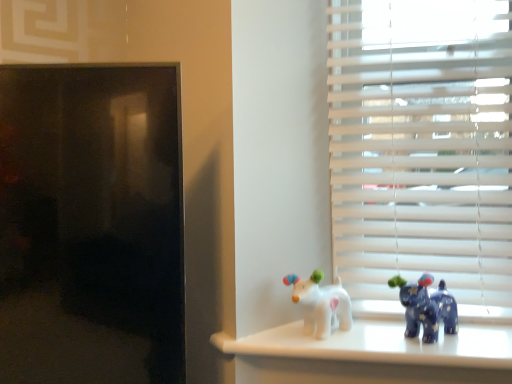
Locate an element on the screen. This screenshot has height=384, width=512. white matte blinds at right is located at coordinates (422, 151).

The image size is (512, 384). Identify the location of white glossy dog at center, positioned as the 1th toy in left-to-right order. (321, 304).

Is blue glossy elephant at right, acting as the second toy starting from the left, spatially inside white glossy dog at center, the second toy in the right-to-left sequence, or outside of it?

blue glossy elephant at right, acting as the second toy starting from the left, exists outside the volume of white glossy dog at center, the second toy in the right-to-left sequence.

Is point (433, 278) less distant than point (336, 299)?

Yes.

Which is more to the left, blue glossy elephant at right, arranged as the first toy when viewed from the right, or white glossy dog at center, positioned as the 1th toy in left-to-right order?

white glossy dog at center, positioned as the 1th toy in left-to-right order.

Does blue glossy elephant at right, acting as the second toy starting from the left, turn towards white glossy dog at center, the second toy in the right-to-left sequence?

No, blue glossy elephant at right, acting as the second toy starting from the left, is not turned towards white glossy dog at center, the second toy in the right-to-left sequence.

I want to click on window blind that is on the right side of blue glossy elephant at right, arranged as the first toy when viewed from the right, so click(422, 151).

Is blue glossy elephant at right, arranged as the first toy when viewed from the right, looking in the opposite direction of white matte blinds at right?

Yes, white matte blinds at right is at the back of blue glossy elephant at right, arranged as the first toy when viewed from the right.

Considering the positions of objects blue glossy elephant at right, arranged as the first toy when viewed from the right, and white matte blinds at right in the image provided, who is more to the left, blue glossy elephant at right, arranged as the first toy when viewed from the right, or white matte blinds at right?

From the viewer's perspective, blue glossy elephant at right, arranged as the first toy when viewed from the right, appears more on the left side.

Would you say blue glossy elephant at right, acting as the second toy starting from the left, is outside white matte blinds at right?

Yes.

At what (x,y) coordinates should I click in order to perform the action: click on toy that is the 1st one when counting forward from the white matte blinds at right. Please return your answer as a coordinate pair (x, y). The width and height of the screenshot is (512, 384). Looking at the image, I should click on (321, 304).

Looking at this image, is white matte blinds at right smaller than white glossy dog at center, positioned as the 1th toy in left-to-right order?

No, white matte blinds at right is not smaller than white glossy dog at center, positioned as the 1th toy in left-to-right order.

Would you say white matte blinds at right is to the left or to the right of white glossy dog at center, positioned as the 1th toy in left-to-right order, in the picture?

From the image, it's evident that white matte blinds at right is to the right of white glossy dog at center, positioned as the 1th toy in left-to-right order.

Is point (426, 104) more distant than point (328, 321)?

Yes.

Is white glossy dog at center, positioned as the 1th toy in left-to-right order, not within white matte blinds at right?

Absolutely, white glossy dog at center, positioned as the 1th toy in left-to-right order, is external to white matte blinds at right.

From the image's perspective, is white glossy dog at center, positioned as the 1th toy in left-to-right order, positioned above or below white matte blinds at right?

From the image's perspective, white glossy dog at center, positioned as the 1th toy in left-to-right order, appears below white matte blinds at right.

Is point (319, 305) closer to viewer compared to point (411, 51)?

Yes, point (319, 305) is in front of point (411, 51).

Considering the sizes of objects white matte blinds at right and blue glossy elephant at right, acting as the second toy starting from the left, in the image provided, who is smaller, white matte blinds at right or blue glossy elephant at right, acting as the second toy starting from the left,?

With smaller size is blue glossy elephant at right, acting as the second toy starting from the left.

Is white matte blinds at right wider than blue glossy elephant at right, acting as the second toy starting from the left?

Yes.

Is white matte blinds at right in contact with blue glossy elephant at right, acting as the second toy starting from the left?

No, white matte blinds at right is not beside blue glossy elephant at right, acting as the second toy starting from the left.

In terms of height, does white matte blinds at right look taller or shorter compared to blue glossy elephant at right, acting as the second toy starting from the left?

In the image, white matte blinds at right appears to be taller than blue glossy elephant at right, acting as the second toy starting from the left.

Would you say blue glossy elephant at right, arranged as the first toy when viewed from the right, is part of white glossy dog at center, the second toy in the right-to-left sequence,'s contents?

No, blue glossy elephant at right, arranged as the first toy when viewed from the right, is not a part of white glossy dog at center, the second toy in the right-to-left sequence.

Considering the positions of objects white glossy dog at center, positioned as the 1th toy in left-to-right order, and blue glossy elephant at right, arranged as the first toy when viewed from the right, in the image provided, who is behind, white glossy dog at center, positioned as the 1th toy in left-to-right order, or blue glossy elephant at right, arranged as the first toy when viewed from the right,?

white glossy dog at center, positioned as the 1th toy in left-to-right order.

Is white glossy dog at center, the second toy in the right-to-left sequence, in contact with blue glossy elephant at right, acting as the second toy starting from the left?

No, white glossy dog at center, the second toy in the right-to-left sequence, is not making contact with blue glossy elephant at right, acting as the second toy starting from the left.

Is white glossy dog at center, the second toy in the right-to-left sequence, positioned with its back to blue glossy elephant at right, acting as the second toy starting from the left?

white glossy dog at center, the second toy in the right-to-left sequence, is not turned away from blue glossy elephant at right, acting as the second toy starting from the left.

Where is `toy below the white glossy dog at center, the second toy in the right-to-left sequence (from a real-world perspective)`? The width and height of the screenshot is (512, 384). toy below the white glossy dog at center, the second toy in the right-to-left sequence (from a real-world perspective) is located at coordinates tap(426, 307).

You are a GUI agent. You are given a task and a screenshot of the screen. Output one action in this format:
    pyautogui.click(x=<x>, y=<y>)
    Task: Click on the window blind located above the blue glossy elephant at right, acting as the second toy starting from the left (from a real-world perspective)
    
    Given the screenshot: What is the action you would take?
    pyautogui.click(x=422, y=151)

When comparing their distances from blue glossy elephant at right, arranged as the first toy when viewed from the right, does white matte blinds at right or white glossy dog at center, the second toy in the right-to-left sequence, seem further?

white matte blinds at right.

Looking at the image, which one is located closer to white glossy dog at center, positioned as the 1th toy in left-to-right order, white matte blinds at right or blue glossy elephant at right, arranged as the first toy when viewed from the right?

blue glossy elephant at right, arranged as the first toy when viewed from the right, lies closer to white glossy dog at center, positioned as the 1th toy in left-to-right order, than the other object.

Which object lies further to the anchor point white matte blinds at right, white glossy dog at center, positioned as the 1th toy in left-to-right order, or blue glossy elephant at right, arranged as the first toy when viewed from the right?

Among the two, white glossy dog at center, positioned as the 1th toy in left-to-right order, is located further to white matte blinds at right.

From the picture: Estimate the real-world distances between objects in this image. Which object is closer to white matte blinds at right, blue glossy elephant at right, acting as the second toy starting from the left, or white glossy dog at center, the second toy in the right-to-left sequence?

blue glossy elephant at right, acting as the second toy starting from the left, is positioned closer to the anchor white matte blinds at right.

Estimate the real-world distances between objects in this image. Which object is further from white glossy dog at center, the second toy in the right-to-left sequence, blue glossy elephant at right, arranged as the first toy when viewed from the right, or white matte blinds at right?

white matte blinds at right lies further to white glossy dog at center, the second toy in the right-to-left sequence, than the other object.

From the picture: From the image, which object appears to be nearer to blue glossy elephant at right, acting as the second toy starting from the left, white glossy dog at center, the second toy in the right-to-left sequence, or white matte blinds at right?

white glossy dog at center, the second toy in the right-to-left sequence, lies closer to blue glossy elephant at right, acting as the second toy starting from the left, than the other object.

The image size is (512, 384). I want to click on toy between white matte blinds at right and white glossy dog at center, the second toy in the right-to-left sequence, from top to bottom, so click(x=426, y=307).